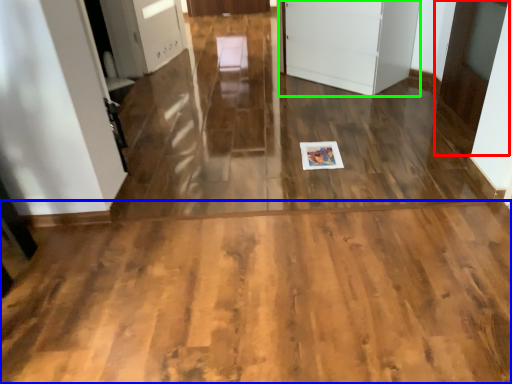
Question: Which object is positioned farthest from door (highlighted by a red box)? Select from corridor (highlighted by a blue box) and door (highlighted by a green box).

Choices:
 (A) corridor
 (B) door

Answer: (A)